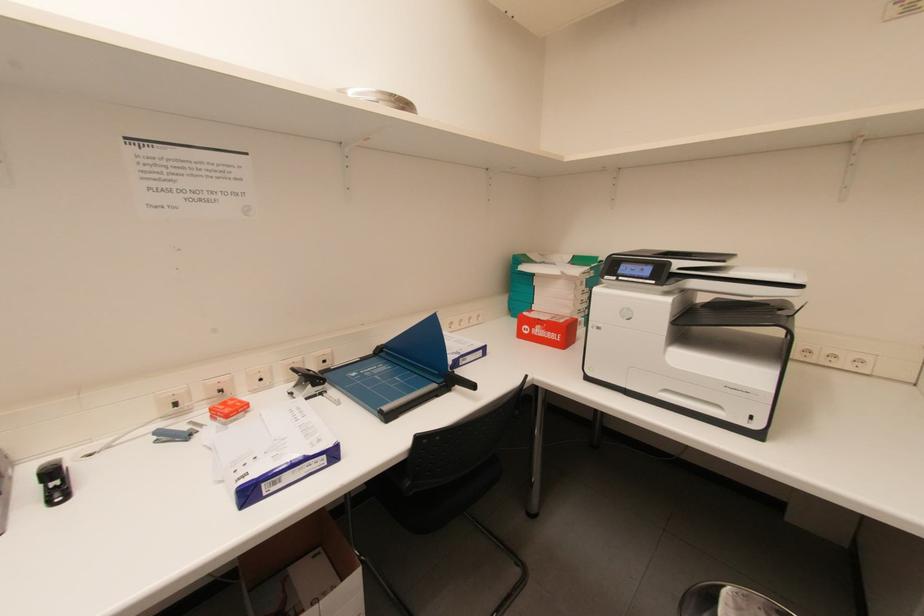
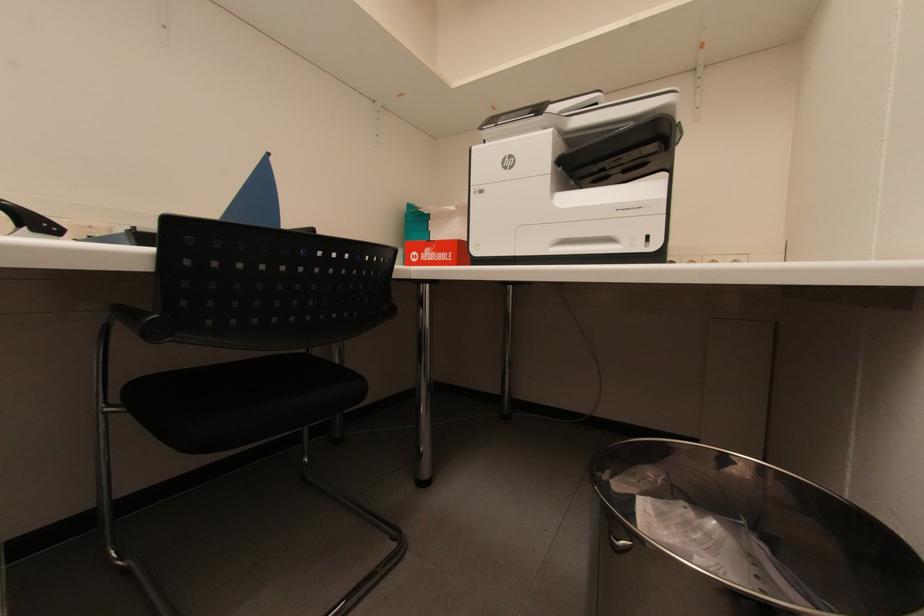
Which direction would the cameraman need to move to produce the second image?

The cameraman moved toward right, forward.